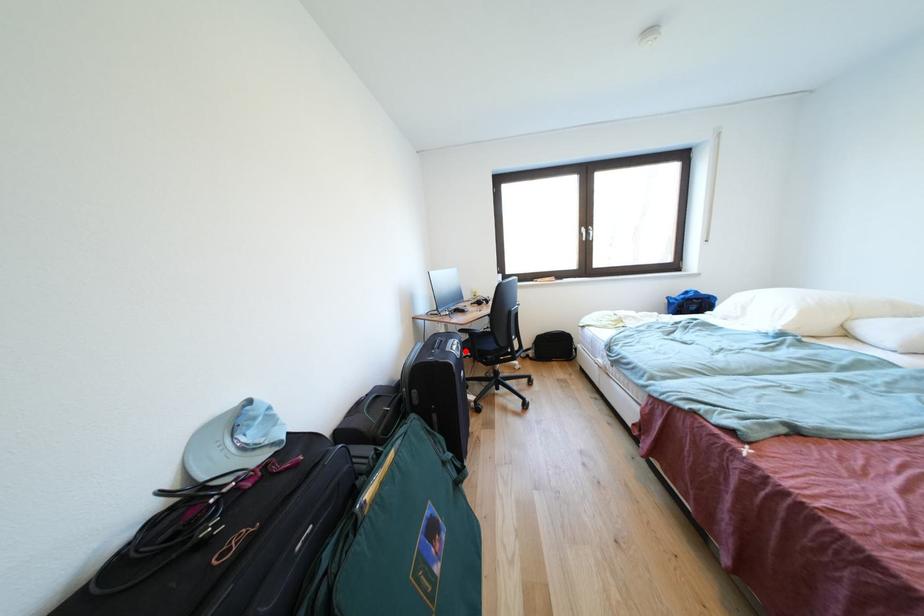
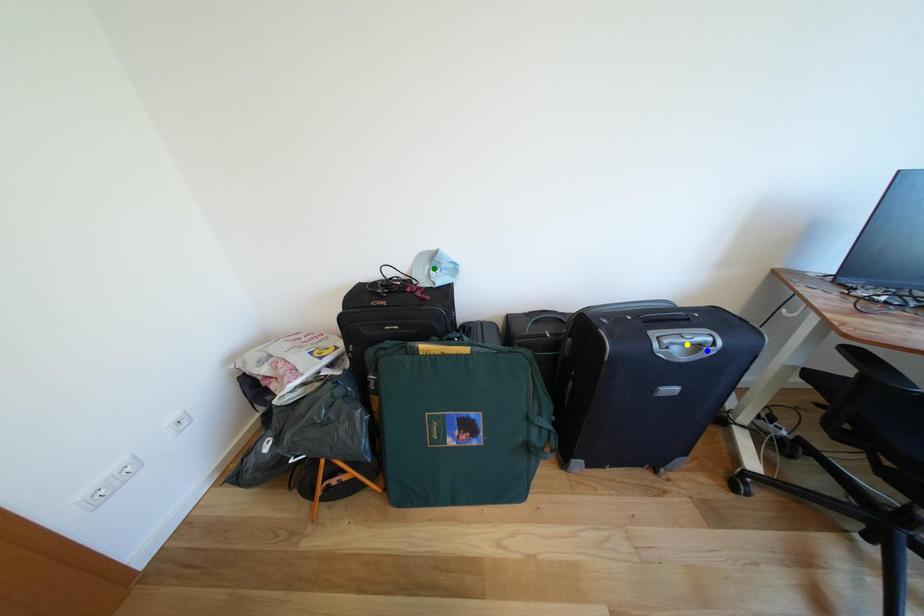
Question: I am providing you with two images of the same scene from different viewpoints. A red point is marked on the first image. You are given multiple points on the second image. In image 2, which mark is for the same physical point as the one in image 1?

Choices:
 (A) green point
 (B) blue point
 (C) yellow point

Answer: (B)